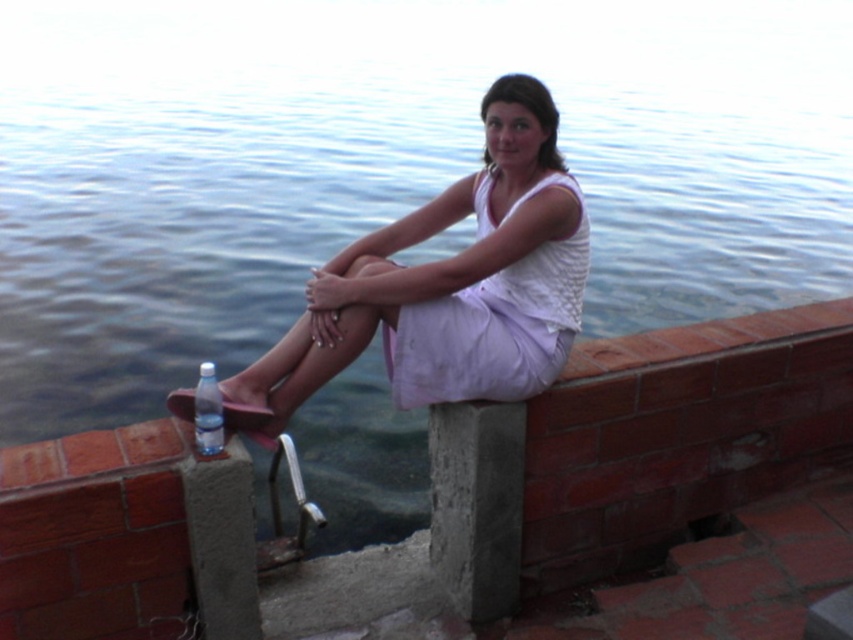
Question: Which point is farther to the camera?

Choices:
 (A) (201, 435)
 (B) (556, 252)

Answer: (B)

Question: Estimate the real-world distances between objects in this image. Which object is farther from the clear plastic bottle at lower left?

Choices:
 (A) white cotton dress at center
 (B) white matte dress at center

Answer: (A)

Question: Can you confirm if white matte dress at center is smaller than white cotton dress at center?

Choices:
 (A) no
 (B) yes

Answer: (A)

Question: Does white cotton dress at center appear under clear plastic bottle at lower left?

Choices:
 (A) yes
 (B) no

Answer: (B)

Question: Can you confirm if blue water at center is positioned to the left of white matte dress at center?

Choices:
 (A) yes
 (B) no

Answer: (B)

Question: Which of these objects is positioned farthest from the white cotton dress at center?

Choices:
 (A) blue water at center
 (B) white matte dress at center
 (C) clear plastic bottle at lower left

Answer: (A)